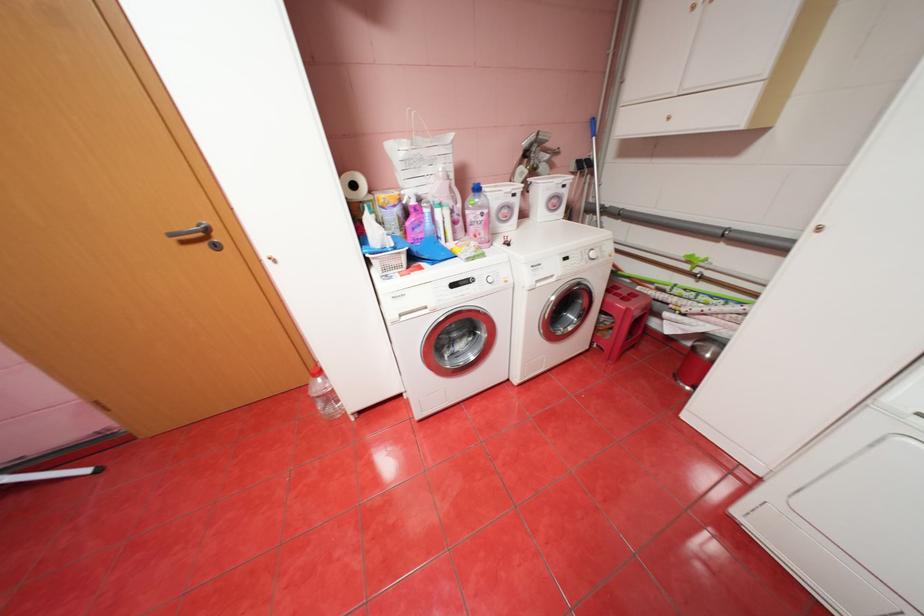
This screenshot has height=616, width=924. What are the coordinates of `washing machine dial` in the screenshot? It's located at (599, 253).